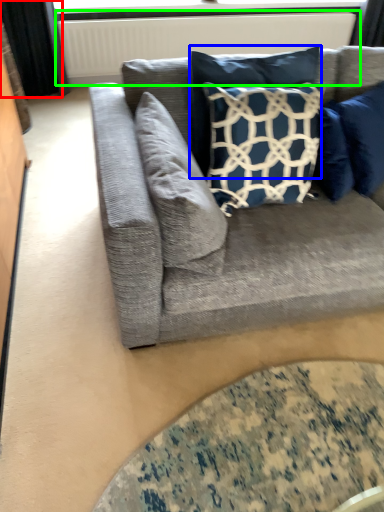
Question: Which object is the farthest from curtain (highlighted by a red box)? Choose among these: pillow (highlighted by a blue box) or radiator (highlighted by a green box).

Choices:
 (A) pillow
 (B) radiator

Answer: (A)